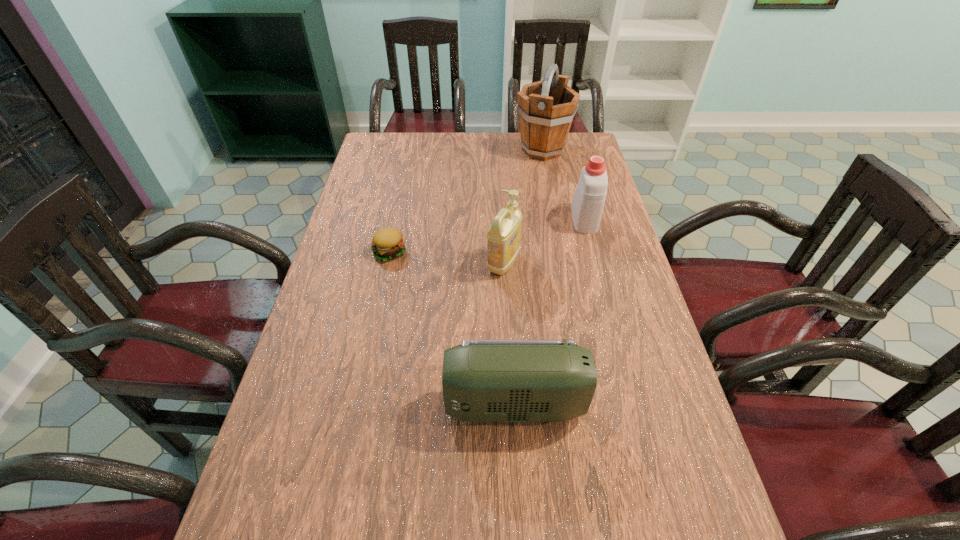
The width and height of the screenshot is (960, 540). What are the coordinates of `vacant area that lies between the second farthest object and the radio_receiver` in the screenshot? It's located at (549, 312).

In order to click on vacant point located between the radio_receiver and the fourth nearest object in this screenshot , I will do `click(549, 312)`.

The width and height of the screenshot is (960, 540). I want to click on vacant space in between the hamburger and the right detergent, so click(487, 235).

This screenshot has height=540, width=960. I want to click on free space between the radio_receiver and the nearer detergent, so click(509, 333).

Select which object appears as the second closest to the bucket. Please provide its 2D coordinates. Your answer should be formatted as a tuple, i.e. [(x, y)], where the tuple contains the x and y coordinates of a point satisfying the conditions above.

[(503, 236)]

At what (x,y) coordinates should I click in order to perform the action: click on object that is the second closest one to the nearer detergent. Please return your answer as a coordinate pair (x, y). This screenshot has height=540, width=960. Looking at the image, I should click on (x=387, y=243).